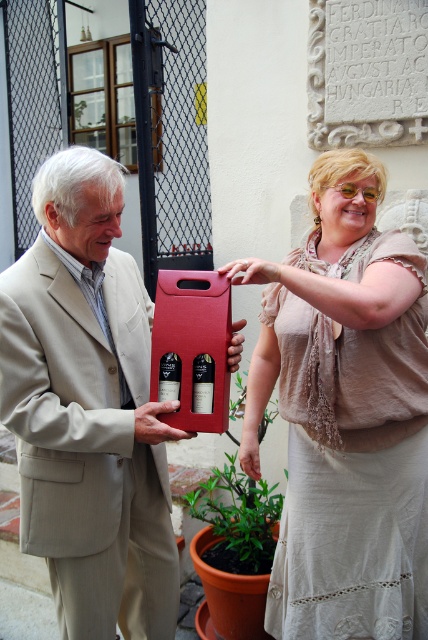
Does matte beige dress at center have a greater height compared to green leafy plant at center?

Yes, matte beige dress at center is taller than green leafy plant at center.

What do you see at coordinates (344, 413) in the screenshot? This screenshot has height=640, width=428. I see `matte beige dress at center` at bounding box center [344, 413].

Who is more distant from viewer, (x=412, y=376) or (x=240, y=518)?

The point (x=240, y=518) is behind.

You are a GUI agent. You are given a task and a screenshot of the screen. Output one action in this format:
    pyautogui.click(x=<x>, y=<y>)
    Task: Click on the matte beige dress at center
    The image size is (428, 640).
    Given the screenshot: What is the action you would take?
    pyautogui.click(x=344, y=413)

Is point (413, 484) farther from camera compared to point (67, 508)?

Yes.

Locate an element on the screen. The width and height of the screenshot is (428, 640). matte beige dress at center is located at coordinates (344, 413).

Which is in front, point (422, 392) or point (79, 163)?

Point (79, 163) is more forward.

This screenshot has height=640, width=428. In order to click on matte beige dress at center in this screenshot , I will do `click(344, 413)`.

Locate an element on the screen. This screenshot has height=640, width=428. green leafy plant at center is located at coordinates (238, 516).

Which is in front, point (220, 563) or point (169, 376)?

Point (169, 376)

Is point (264, 531) positioned before point (175, 369)?

No.

Identify the location of green leafy plant at center. The width and height of the screenshot is (428, 640). (238, 516).